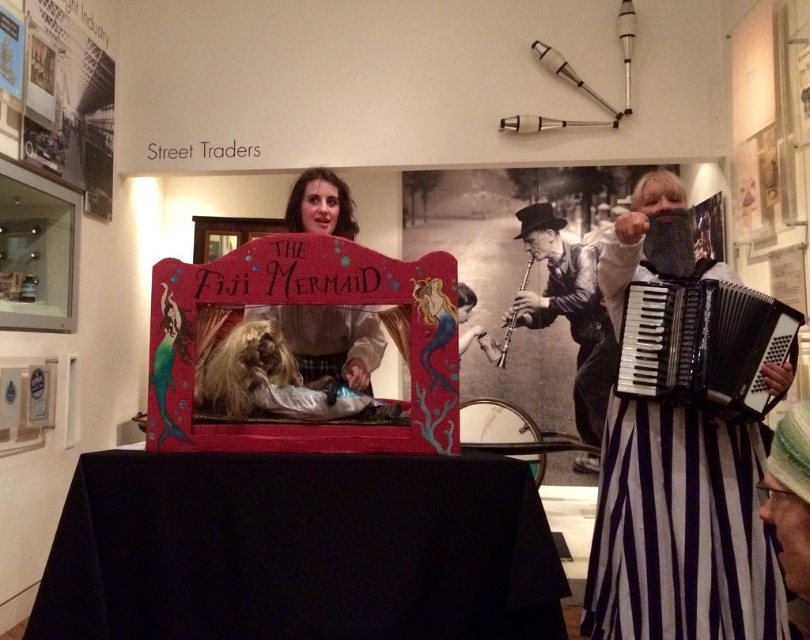
Which is below, black fabric table at center or matte pink puppet at center?

black fabric table at center is below.

Can you confirm if black fabric table at center is positioned below matte pink puppet at center?

Yes, black fabric table at center is below matte pink puppet at center.

The image size is (810, 640). Identify the location of black fabric table at center. (299, 548).

Between black striped dress at right and black and white clarinet at center, which one appears on the right side from the viewer's perspective?

black and white clarinet at center is more to the right.

Is point (698, 448) positioned behind point (578, 300)?

No, (698, 448) is closer to viewer.

Locate an element on the screen. The image size is (810, 640). black striped dress at right is located at coordinates (680, 529).

Does black fabric table at center have a greater height compared to black plastic accordion at right?

In fact, black fabric table at center may be shorter than black plastic accordion at right.

Is point (245, 536) positioned behind point (644, 339)?

No, (245, 536) is closer to viewer.

I want to click on black fabric table at center, so click(299, 548).